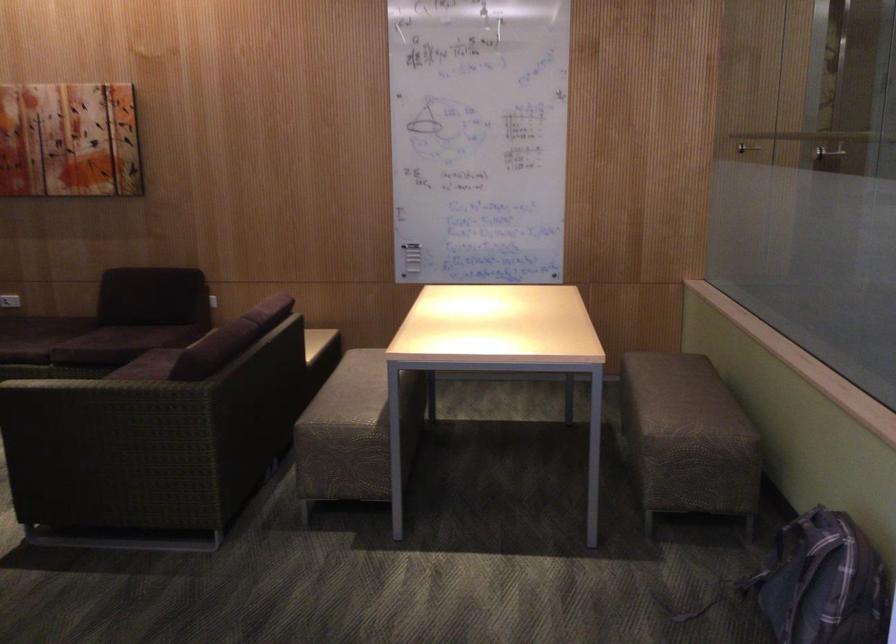
The width and height of the screenshot is (896, 644). Find the location of `patterned sofa armrest`. patterned sofa armrest is located at coordinates (96, 382).